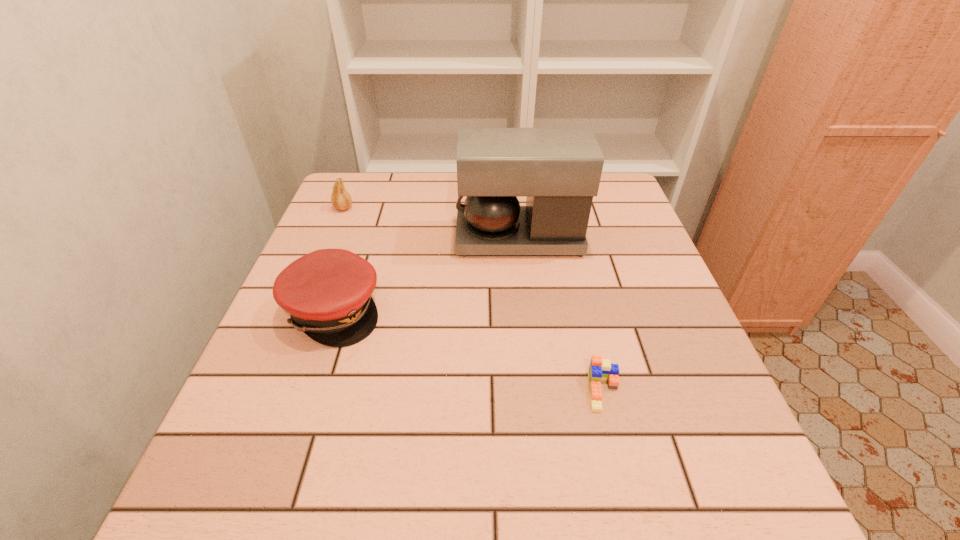
This screenshot has height=540, width=960. I want to click on vacant area at the far right corner, so click(612, 181).

What are the coordinates of `blank region between the cap and the coffee maker` in the screenshot? It's located at (426, 274).

Locate an element on the screen. vacant region between the cap and the shortest object is located at coordinates [468, 351].

Where is `empty location between the farthest object and the Lego`? empty location between the farthest object and the Lego is located at coordinates click(x=473, y=300).

Find the location of `vacant space in between the cap and the third nearest object`. vacant space in between the cap and the third nearest object is located at coordinates (426, 274).

The width and height of the screenshot is (960, 540). Identify the location of vacant space in between the farthest object and the nearest object. (473, 300).

The width and height of the screenshot is (960, 540). Identify the location of unoccupied area between the coffee maker and the pear. (431, 223).

This screenshot has width=960, height=540. Identify the location of vacant area between the second nearest object and the shortest object. (468, 351).

Where is `empty space that is in between the cap and the shortest object`? empty space that is in between the cap and the shortest object is located at coordinates (468, 351).

Locate which object is the second closest to the cap. Please provide its 2D coordinates. Your answer should be formatted as a tuple, i.e. [(x, y)], where the tuple contains the x and y coordinates of a point satisfying the conditions above.

[(340, 199)]